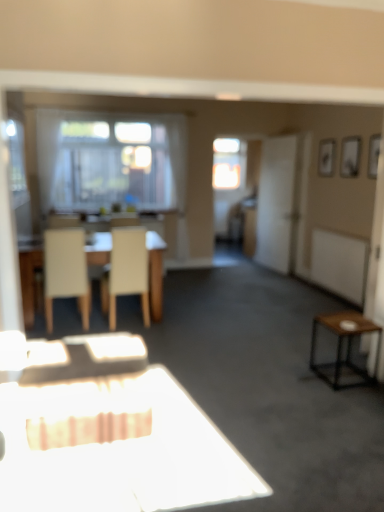
Question: Should I look upward or downward to see brown wooden side table at right?

Choices:
 (A) up
 (B) down

Answer: (B)

Question: From the image's perspective, is light beige wood table at center beneath white matte screen door at right?

Choices:
 (A) yes
 (B) no

Answer: (A)

Question: Is light beige wood table at center thinner than white matte screen door at right?

Choices:
 (A) yes
 (B) no

Answer: (B)

Question: From the image's perspective, is light beige wood table at center over white matte screen door at right?

Choices:
 (A) yes
 (B) no

Answer: (B)

Question: Can you confirm if light beige wood table at center is shorter than white matte screen door at right?

Choices:
 (A) yes
 (B) no

Answer: (A)

Question: Is light beige wood table at center smaller than white matte screen door at right?

Choices:
 (A) no
 (B) yes

Answer: (A)

Question: Is white matte screen door at right surrounded by light beige wood table at center?

Choices:
 (A) no
 (B) yes

Answer: (A)

Question: Does transparent glass window at center have a lesser height compared to brown wooden side table at right?

Choices:
 (A) yes
 (B) no

Answer: (B)

Question: Does transparent glass window at center turn towards brown wooden side table at right?

Choices:
 (A) yes
 (B) no

Answer: (A)

Question: From a real-world perspective, is transparent glass window at center under brown wooden side table at right?

Choices:
 (A) no
 (B) yes

Answer: (A)

Question: Does transparent glass window at center lie in front of brown wooden side table at right?

Choices:
 (A) yes
 (B) no

Answer: (B)

Question: Is transparent glass window at center thinner than brown wooden side table at right?

Choices:
 (A) yes
 (B) no

Answer: (A)

Question: Is transparent glass window at center wider than brown wooden side table at right?

Choices:
 (A) yes
 (B) no

Answer: (B)

Question: Considering the relative positions of light beige wood table at center and transparent glass window at center in the image provided, is light beige wood table at center to the right of transparent glass window at center from the viewer's perspective?

Choices:
 (A) no
 (B) yes

Answer: (A)